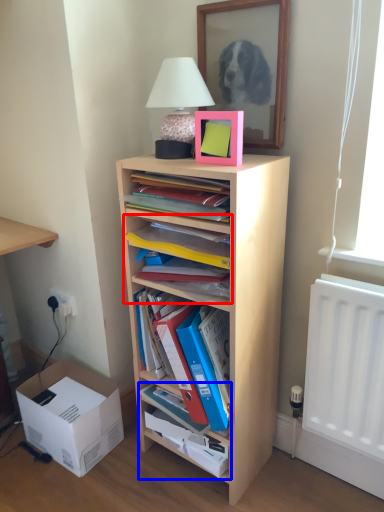
Question: Which point is closer to the camera, shelf (highlighted by a red box) or cabinet (highlighted by a blue box)?

Choices:
 (A) shelf
 (B) cabinet

Answer: (A)